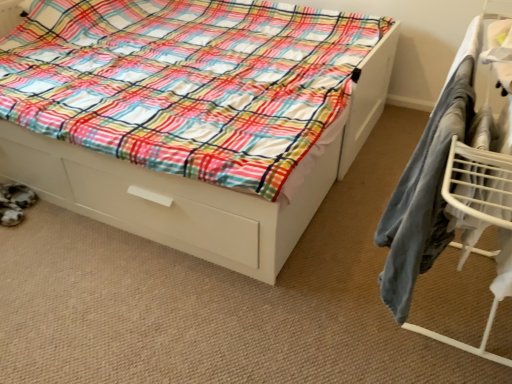
Identify the location of vacant space that is to the left of metal drying rack at right. pyautogui.click(x=230, y=303).